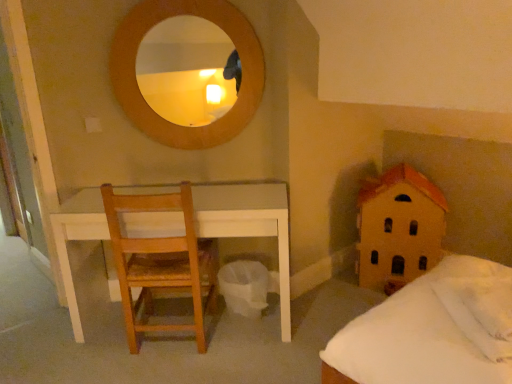
You are a GUI agent. You are given a task and a screenshot of the screen. Output one action in this format:
    pyautogui.click(x=<x>, y=<y>)
    Task: Click on the vacant space in light brown wooden chair at left (from a real-world perspective)
    The height and width of the screenshot is (384, 512).
    Given the screenshot: What is the action you would take?
    pyautogui.click(x=167, y=344)